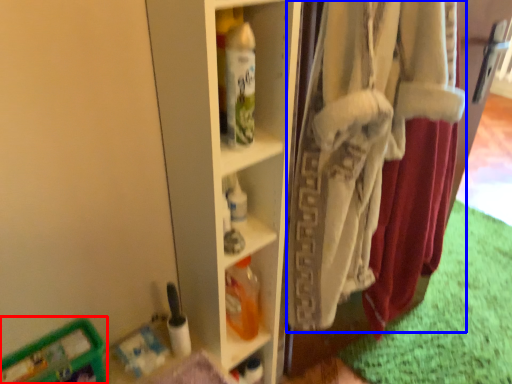
Question: Which object is further to the camera taking this photo, wide (highlighted by a red box) or underclothes (highlighted by a blue box)?

Choices:
 (A) wide
 (B) underclothes

Answer: (A)